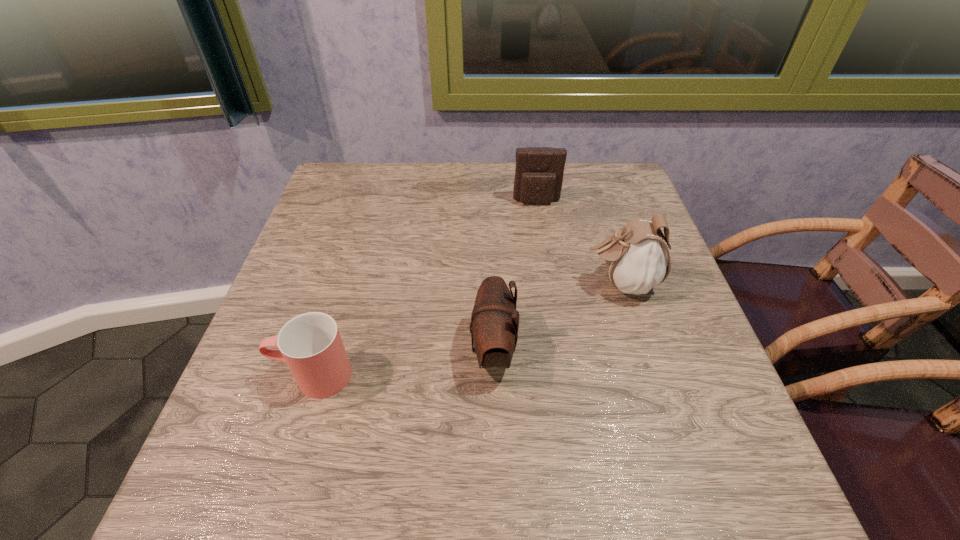
The height and width of the screenshot is (540, 960). In the image, there is a desktop. What are the coordinates of `free space at the near edge` in the screenshot? It's located at (454, 452).

Where is `free space at the left edge of the desktop`? This screenshot has height=540, width=960. free space at the left edge of the desktop is located at coordinates (356, 241).

This screenshot has width=960, height=540. What are the coordinates of `vacant area at the right edge` in the screenshot? It's located at (708, 376).

At what (x,y) coordinates should I click in order to perform the action: click on vacant area that lies between the nearest pouch and the second object from right to left. Please return your answer as a coordinate pair (x, y). Looking at the image, I should click on (515, 276).

Identify the location of vacant space that's between the leftmost pouch and the second nearest pouch. This screenshot has width=960, height=540. (557, 316).

What are the coordinates of `empty location between the second farthest object and the farthest pouch` in the screenshot? It's located at (579, 242).

I want to click on vacant area that lies between the tallest pouch and the second pouch from left to right, so click(x=579, y=242).

Identify the location of vacant space in between the shortest object and the tallest object. The width and height of the screenshot is (960, 540). (468, 329).

This screenshot has width=960, height=540. I want to click on blank region between the second object from left to right and the farthest pouch, so click(515, 276).

Locate an element on the screen. The image size is (960, 540). free space between the second pouch from right to left and the leftmost pouch is located at coordinates (515, 276).